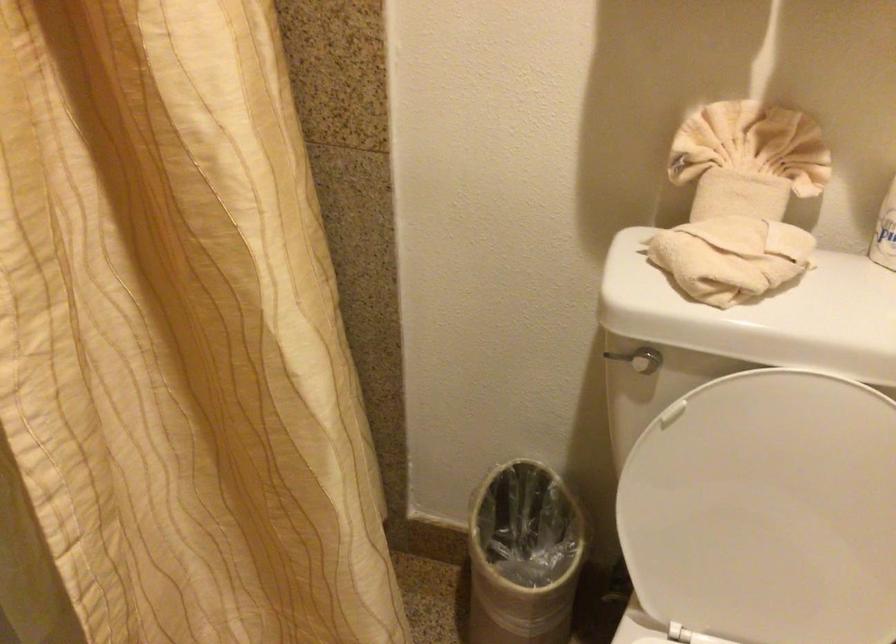
This screenshot has height=644, width=896. Find the location of `silver flush handle`. silver flush handle is located at coordinates (616, 357).